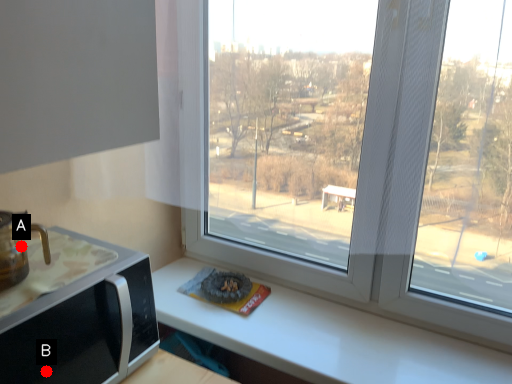
Question: Two points are circled on the image, labeled by A and B beside each circle. Which point appears farthest from the camera in this image?

Choices:
 (A) A is further
 (B) B is further

Answer: (A)